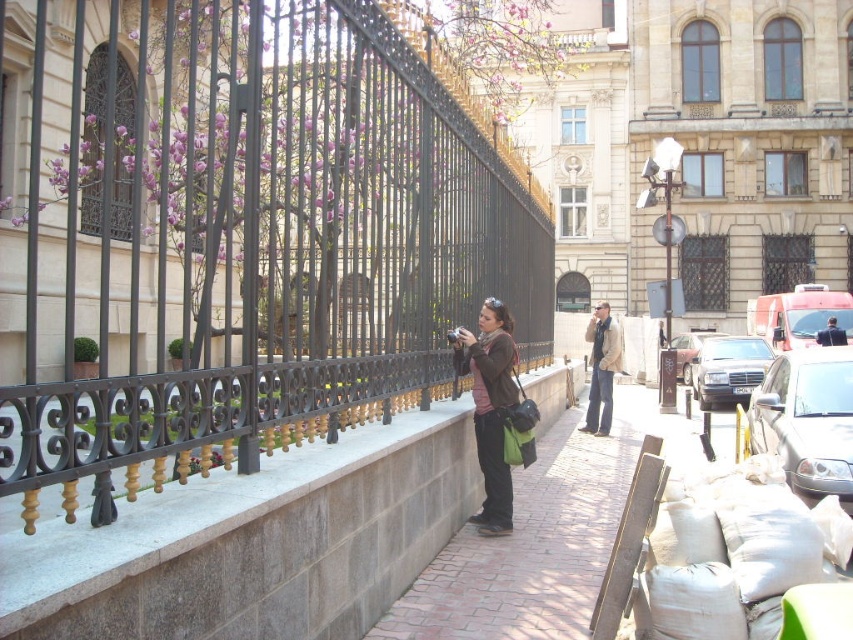
Between gray stone ledge at center and black metallic car at center, which one appears on the right side from the viewer's perspective?

black metallic car at center

Is gray stone ledge at center below black metallic car at center?

Yes, gray stone ledge at center is below black metallic car at center.

Who is more distant from viewer, [318,595] or [732,340]?

The point [732,340] is more distant.

Locate an element on the screen. gray stone ledge at center is located at coordinates (254, 544).

Between metallic silver car at right and dark blue suit at center, which one appears on the right side from the viewer's perspective?

dark blue suit at center

Is metallic silver car at right bigger than dark blue suit at center?

Yes.

Between point (761, 404) and point (828, 342), which one is positioned in front?

Point (761, 404) is in front.

Where is `metallic silver car at right`? This screenshot has height=640, width=853. metallic silver car at right is located at coordinates (807, 420).

Who is shorter, brick pavement at center or metallic silver sedan at center-right?

brick pavement at center is shorter.

Measure the distance between point [509,566] and camera.

Point [509,566] and camera are 56.32 feet apart.

Find the location of `brick pavement at center`. brick pavement at center is located at coordinates (535, 540).